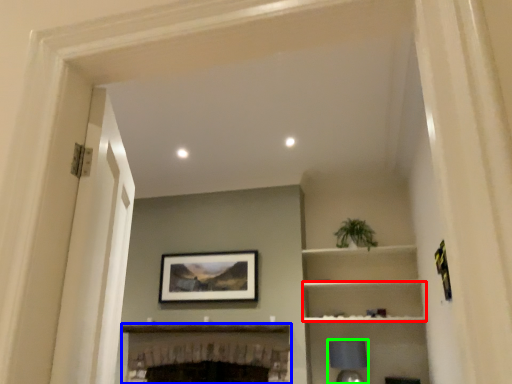
Question: Based on their relative distances, which object is nearer to cabinet (highlighted by a red box)? Choose from fireplace (highlighted by a blue box) and lamp (highlighted by a green box).

Choices:
 (A) fireplace
 (B) lamp

Answer: (B)